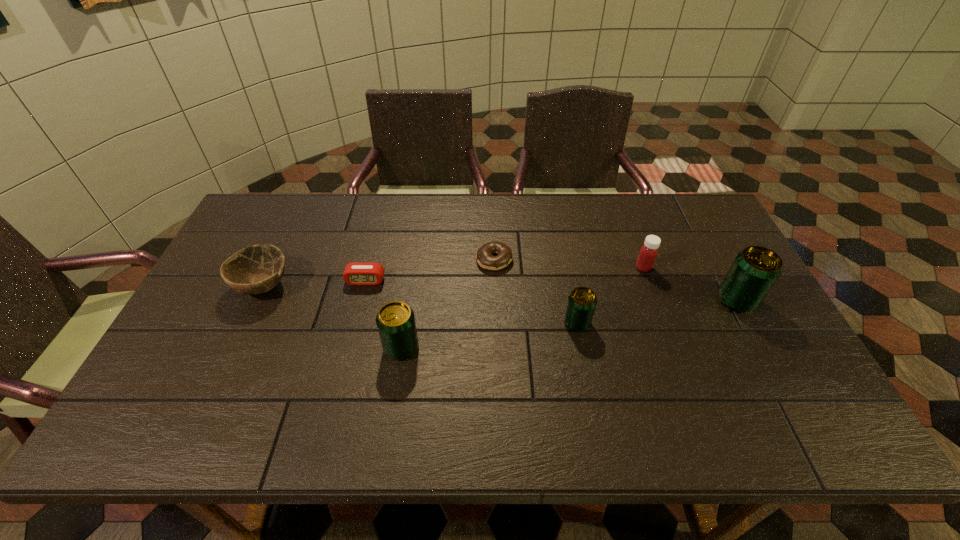
I want to click on free spot that satisfies the following two spatial constraints: 1. on the back side of the leftmost object; 2. on the right side of the medicine, so 272,268.

Locate an element on the screen. Image resolution: width=960 pixels, height=540 pixels. free spot that satisfies the following two spatial constraints: 1. on the front-facing side of the alarm clock; 2. on the right side of the rightmost beer can is located at coordinates (361, 300).